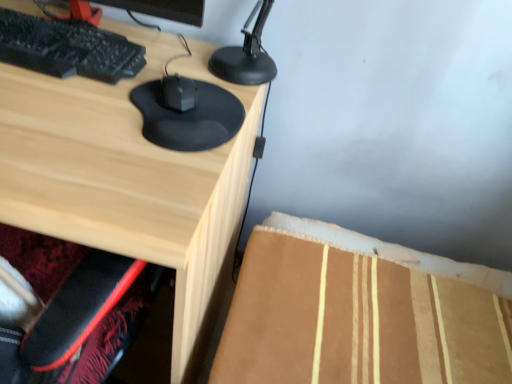
I want to click on free region on the left part of black matte mouse at center, so click(x=69, y=104).